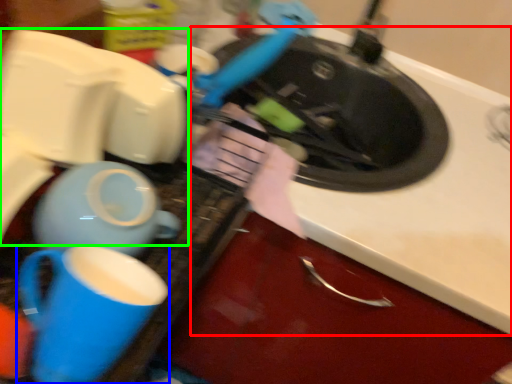
Question: Estimate the real-world distances between objects in this image. Which object is closer to counter top (highlighted by a red box), coffee cup (highlighted by a blue box) or appliance (highlighted by a green box)?

Choices:
 (A) coffee cup
 (B) appliance

Answer: (B)